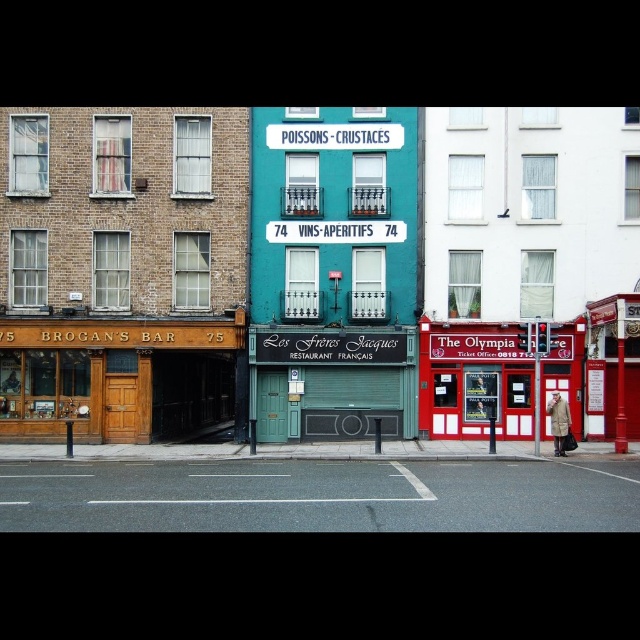
Question: Where is teal painted signboard at center located in relation to red painted metal ticket booth at center in the image?

Choices:
 (A) above
 (B) below

Answer: (A)

Question: Can you confirm if teal painted signboard at center is positioned above red painted metal ticket booth at center?

Choices:
 (A) no
 (B) yes

Answer: (B)

Question: Where is teal painted signboard at center located in relation to red painted metal ticket booth at center in the image?

Choices:
 (A) right
 (B) left

Answer: (B)

Question: Among these points, which one is nearest to the camera?

Choices:
 (A) (392, 349)
 (B) (564, 330)

Answer: (A)